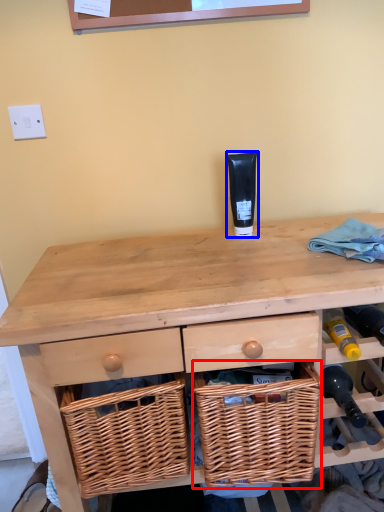
Question: Which object appears farthest to the camera in this image, picnic basket (highlighted by a red box) or toiletry (highlighted by a blue box)?

Choices:
 (A) picnic basket
 (B) toiletry

Answer: (B)